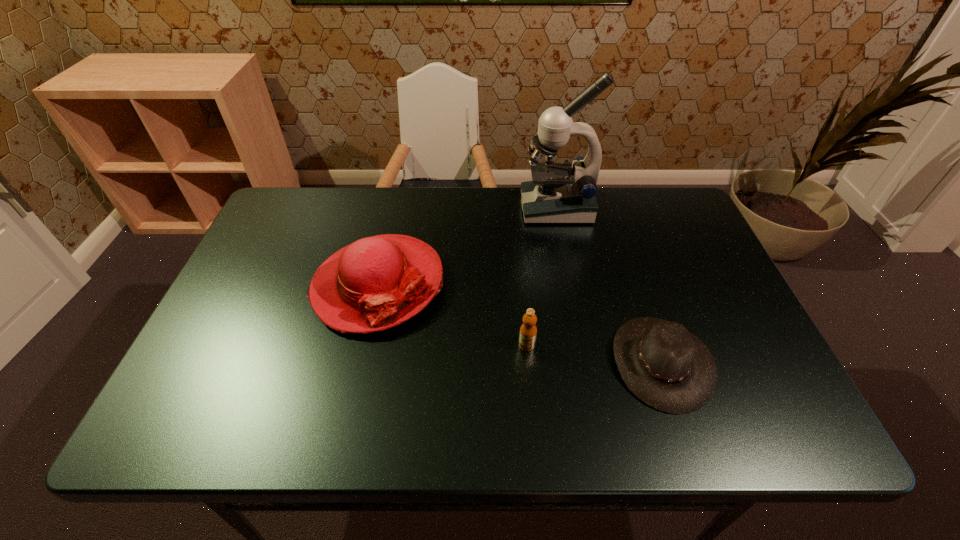
At what (x,y) coordinates should I click in order to perform the action: click on vacant space located 0.340m on the front-facing side of the shortest object. Please return your answer as a coordinate pair (x, y). Image resolution: width=960 pixels, height=540 pixels. Looking at the image, I should click on (459, 362).

Locate an element on the screen. The height and width of the screenshot is (540, 960). vacant space situated 0.240m on the front-facing side of the shortest object is located at coordinates (504, 362).

Image resolution: width=960 pixels, height=540 pixels. In order to click on free space located on the front-facing side of the shortest object in this screenshot , I will do `click(586, 362)`.

Locate an element on the screen. The image size is (960, 540). object that is positioned at the far edge is located at coordinates (559, 193).

Identify the location of object that is at the near edge. Image resolution: width=960 pixels, height=540 pixels. (668, 368).

At what (x,y) coordinates should I click in order to perform the action: click on object situated at the right edge. Please return your answer as a coordinate pair (x, y). This screenshot has height=540, width=960. Looking at the image, I should click on (668, 368).

Identify the location of object situated at the near right corner. (668, 368).

Image resolution: width=960 pixels, height=540 pixels. In order to click on vacant position at the far edge of the desktop in this screenshot , I will do `click(540, 227)`.

Identify the location of vacant region at the near edge of the desktop. (621, 435).

You are a GUI agent. You are given a task and a screenshot of the screen. Output one action in this format:
    pyautogui.click(x=<x>, y=<y>)
    Task: Click on the free region at the left edge
    Image resolution: width=960 pixels, height=540 pixels.
    Given the screenshot: What is the action you would take?
    pyautogui.click(x=222, y=305)